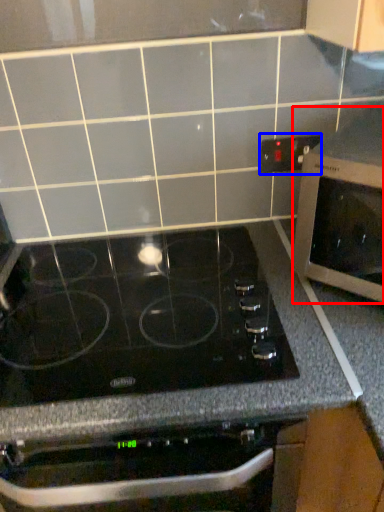
Question: Which object appears farthest to the camera in this image, microwave oven (highlighted by a red box) or electric outlet (highlighted by a blue box)?

Choices:
 (A) microwave oven
 (B) electric outlet

Answer: (B)